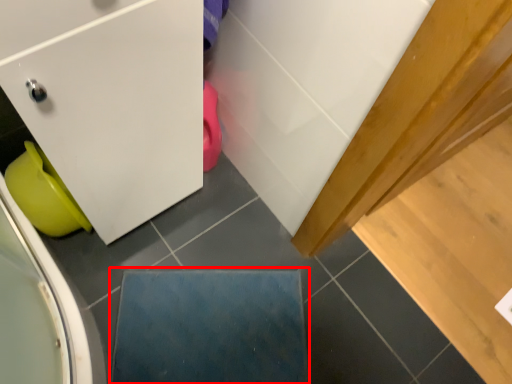
Question: From the image's perspective, considering the relative positions of slate (annotated by the red box) and toilet bowl in the image provided, where is slate (annotated by the red box) located with respect to the staircase?

Choices:
 (A) below
 (B) above

Answer: (A)